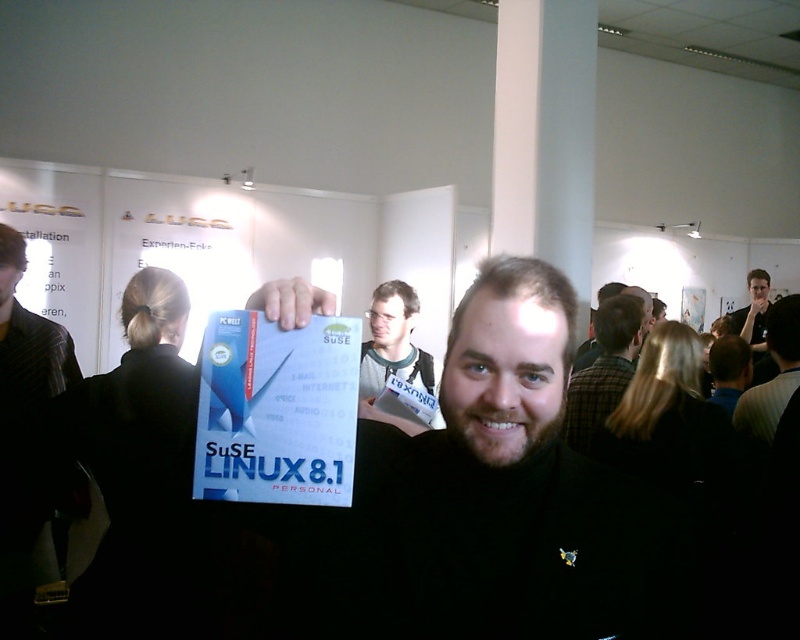
Between white paper at center and matte black glasses at upper center, which one has less height?

Standing shorter between the two is white paper at center.

Does white paper at center appear on the right side of matte black glasses at upper center?

No, white paper at center is not to the right of matte black glasses at upper center.

What do you see at coordinates (276, 410) in the screenshot?
I see `white paper at center` at bounding box center [276, 410].

Identify the location of white paper at center. [276, 410].

Does point (570, 416) come farther from viewer compared to point (770, 356)?

No, (570, 416) is closer to viewer.

Who is more distant from viewer, (605, 304) or (760, 376)?

The point (760, 376) is behind.

Is point (608, 348) farther from viewer compared to point (744, 323)?

That is False.

Find the location of a particular element. The image size is (800, 640). plaid shirt at center is located at coordinates (604, 369).

Does matte black glasses at upper center have a lesser width compared to plaid shirt at center?

Yes, matte black glasses at upper center is thinner than plaid shirt at center.

The height and width of the screenshot is (640, 800). I want to click on matte black glasses at upper center, so click(x=393, y=352).

What are the coordinates of `matte black glasses at upper center` in the screenshot? It's located at (393, 352).